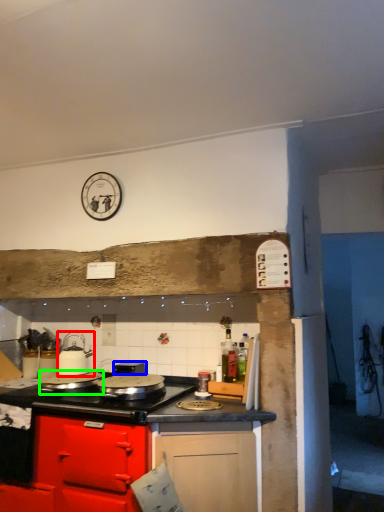
Question: Which object is the farthest from kitchen appliance (highlighted by a red box)? Choose among these: appliance (highlighted by a blue box) or kitchen appliance (highlighted by a green box).

Choices:
 (A) appliance
 (B) kitchen appliance

Answer: (A)